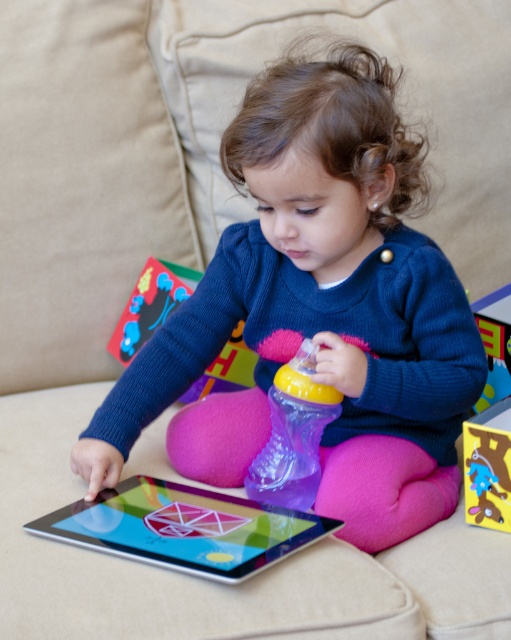
Question: Is matte blue sweater at center bigger than plush blue toy at center?

Choices:
 (A) no
 (B) yes

Answer: (B)

Question: Is transparent plastic bottle at center smaller than rubberized plastic toy at left?

Choices:
 (A) no
 (B) yes

Answer: (B)

Question: Among these points, which one is farthest from the camera?

Choices:
 (A) (160, 260)
 (B) (474, 467)
 (C) (268, 461)

Answer: (A)

Question: Does rubberized plastic toy at left appear over plush blue toy at center?

Choices:
 (A) yes
 (B) no

Answer: (A)

Question: Which point is closer to the camera taking this photo?

Choices:
 (A) (476, 458)
 (B) (189, 566)
 (C) (324, 269)

Answer: (B)

Question: Which point appears closest to the camera in this image?

Choices:
 (A) (237, 340)
 (B) (171, 493)

Answer: (B)